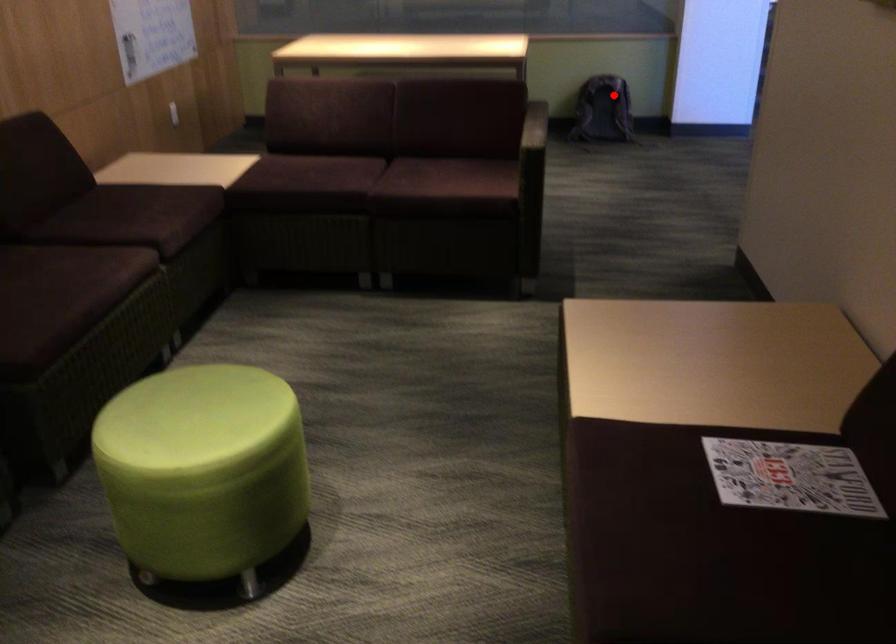
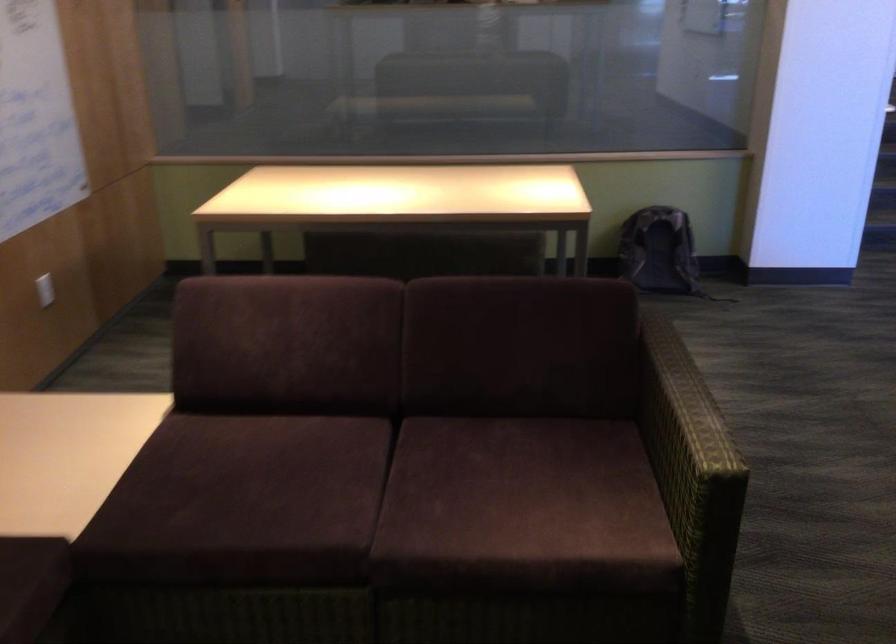
Question: I am providing you with two images of the same scene from different viewpoints. A red point is shown in image1. For the corresponding object point in image2, is it positioned nearer or farther from the camera?

Choices:
 (A) Nearer
 (B) Farther

Answer: (A)